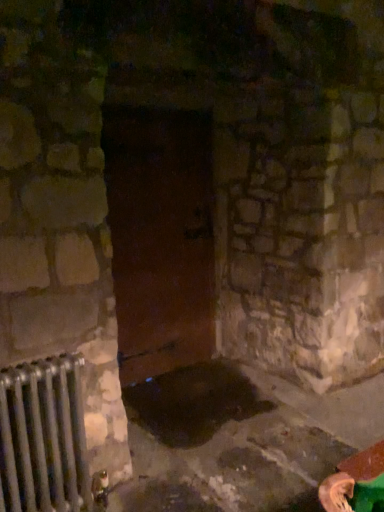
At what (x,y) coordinates should I click in order to perform the action: click on silver metallic radiator at lower left. Please return your answer as a coordinate pair (x, y). Looking at the image, I should click on (43, 437).

Describe the element at coordinates (43, 437) in the screenshot. The image size is (384, 512). I see `silver metallic radiator at lower left` at that location.

Where is `silver metallic radiator at lower left`? This screenshot has width=384, height=512. silver metallic radiator at lower left is located at coordinates (43, 437).